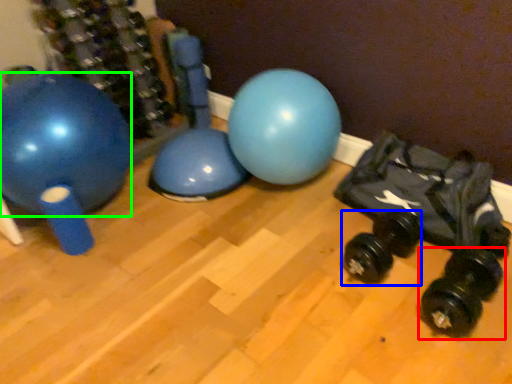
Question: Which object is the farthest from dumbbell (highlighted by a red box)? Choose among these: dumbbell (highlighted by a blue box) or ball (highlighted by a green box).

Choices:
 (A) dumbbell
 (B) ball

Answer: (B)